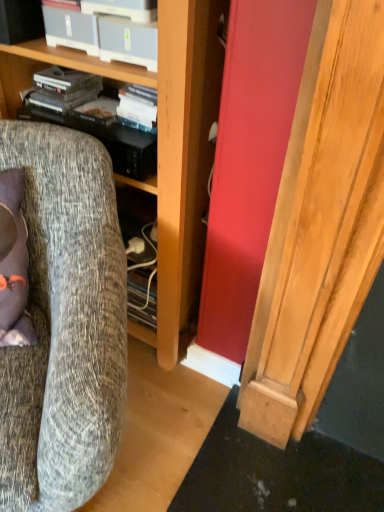
Question: Can you confirm if matte black shelf at upper left is bigger than textured gray fabric chair at left?

Choices:
 (A) yes
 (B) no

Answer: (B)

Question: Is matte black shelf at upper left to the right of textured gray fabric chair at left from the viewer's perspective?

Choices:
 (A) no
 (B) yes

Answer: (B)

Question: Is matte black shelf at upper left shorter than textured gray fabric chair at left?

Choices:
 (A) yes
 (B) no

Answer: (A)

Question: From the image's perspective, would you say matte black shelf at upper left is shown under textured gray fabric chair at left?

Choices:
 (A) no
 (B) yes

Answer: (A)

Question: Is matte black shelf at upper left looking in the opposite direction of textured gray fabric chair at left?

Choices:
 (A) yes
 (B) no

Answer: (B)

Question: From a real-world perspective, is matte black shelf at upper left on textured gray fabric chair at left?

Choices:
 (A) yes
 (B) no

Answer: (A)

Question: Does wooden cabinet at center have a greater height compared to textured gray fabric chair at left?

Choices:
 (A) yes
 (B) no

Answer: (A)

Question: Can you confirm if wooden cabinet at center is wider than textured gray fabric chair at left?

Choices:
 (A) no
 (B) yes

Answer: (A)

Question: Is wooden cabinet at center bigger than textured gray fabric chair at left?

Choices:
 (A) yes
 (B) no

Answer: (A)

Question: From a real-world perspective, is wooden cabinet at center located beneath textured gray fabric chair at left?

Choices:
 (A) no
 (B) yes

Answer: (A)

Question: Is the position of wooden cabinet at center more distant than that of textured gray fabric chair at left?

Choices:
 (A) yes
 (B) no

Answer: (A)

Question: From the image's perspective, is wooden cabinet at center below textured gray fabric chair at left?

Choices:
 (A) no
 (B) yes

Answer: (A)

Question: Is matte black shelf at upper left touching wooden cabinet at center?

Choices:
 (A) yes
 (B) no

Answer: (B)